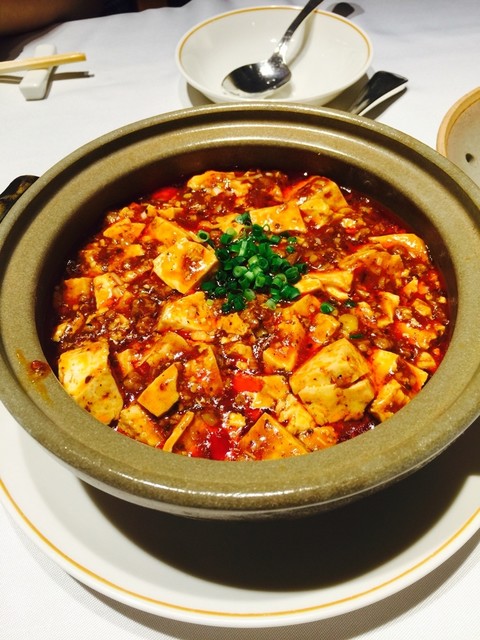
Locate an element on the screen. The height and width of the screenshot is (640, 480). silver spoon is located at coordinates (268, 80).